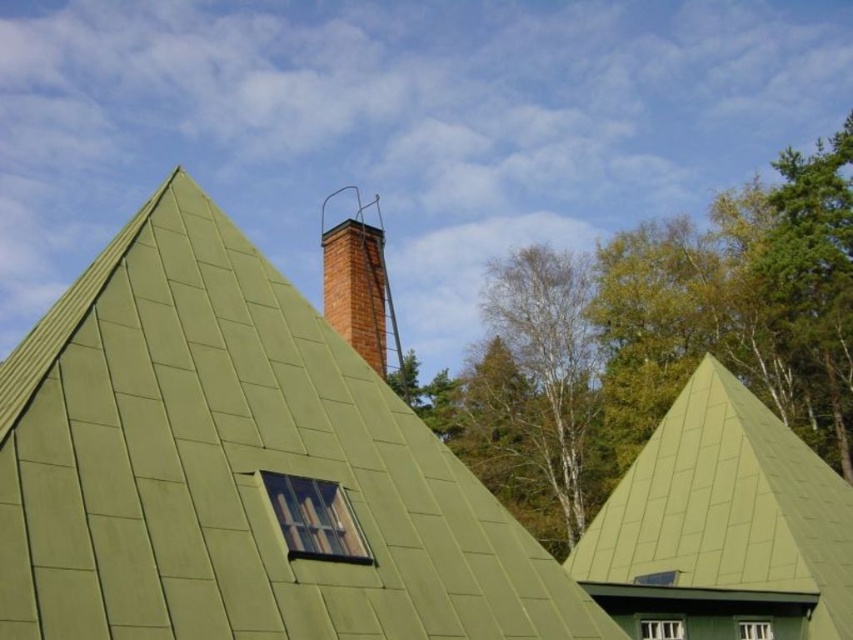
Question: Can you confirm if green matte roof at center is positioned above clear glass window at upper center?

Choices:
 (A) yes
 (B) no

Answer: (A)

Question: Can you confirm if brick chimney at upper center is wider than white plastic window at center?

Choices:
 (A) no
 (B) yes

Answer: (B)

Question: Which point is farther to the camera?

Choices:
 (A) (660, 624)
 (B) (296, 545)

Answer: (A)

Question: Which object appears farthest from the camera in this image?

Choices:
 (A) clear glass window at center
 (B) green matte roof at center

Answer: (B)

Question: Can you confirm if green matte roof at center is positioned above clear glass window at upper center?

Choices:
 (A) yes
 (B) no

Answer: (A)

Question: Considering the real-world distances, which object is farthest from the clear glass window at upper center?

Choices:
 (A) green matte roof at center
 (B) green metal roof at center
 (C) clear glass window at center
 (D) brick chimney at upper center

Answer: (D)